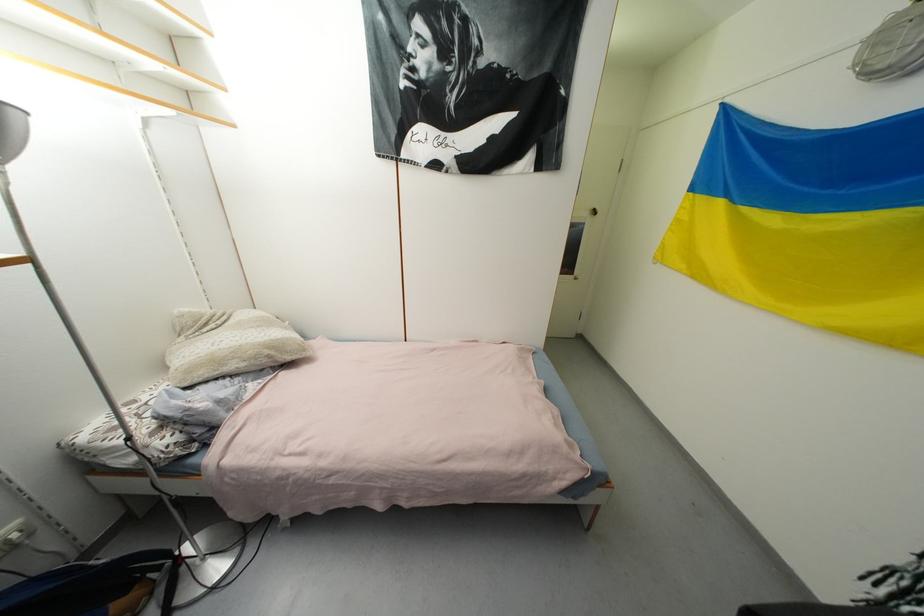
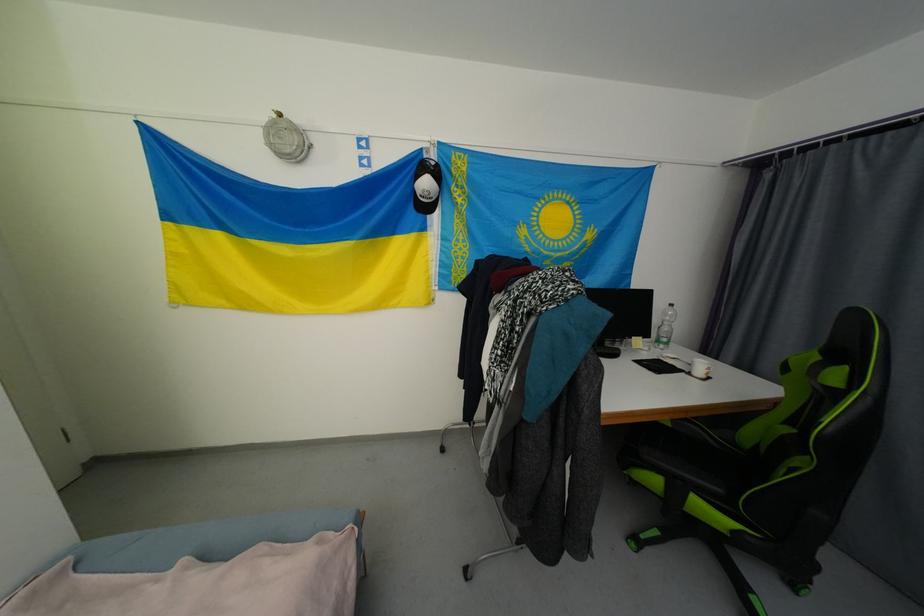
First-person continuous shooting, in which direction is the camera rotating?

The camera's rotation is toward right-down.